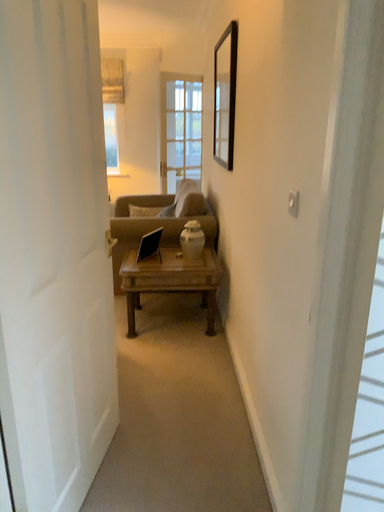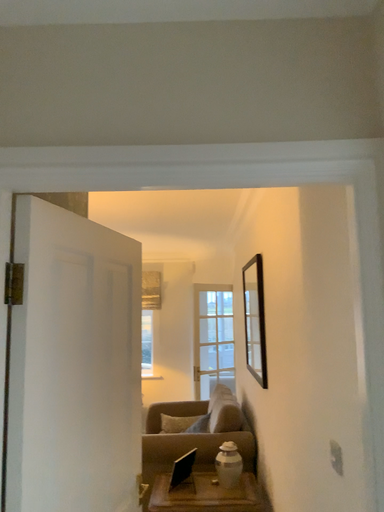
Question: How did the camera likely rotate when shooting the video?

Choices:
 (A) rotated downward
 (B) rotated upward

Answer: (B)